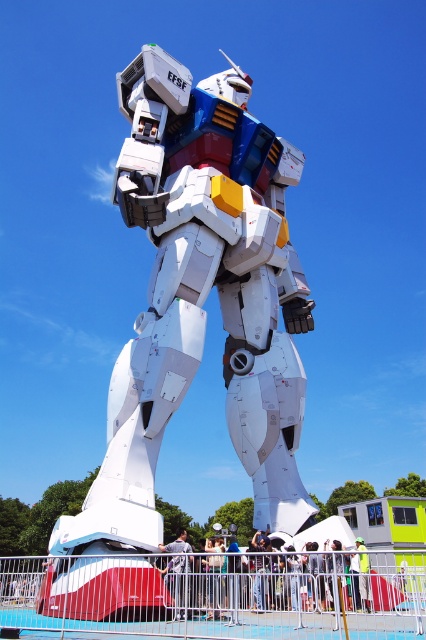
You are a character in the scene and need to adjust your clothing. Which item is positioned to the left when looking at the light gray fabric shirt at center and the light gray fabric pants at center?

The light gray fabric shirt at center is positioned to the left of the light gray fabric pants at center.

You are an astronaut preparing to board the white matte robot at center. You are currently wearing a light gray fabric shirt at center. Will your shirt fit comfortably inside the robot?

The white matte robot at center is wider than the light gray fabric shirt at center, so the shirt will fit comfortably inside the robot.

From the picture: You are an inspector checking the model robot. You notice both the light gray fabric shirt at center and the light gray fabric pants at center. Which part of the robot is more visible to you from your current position?

The light gray fabric shirt at center is closer to the viewer than the light gray fabric pants at center, so the shirt is more visible from your current position.